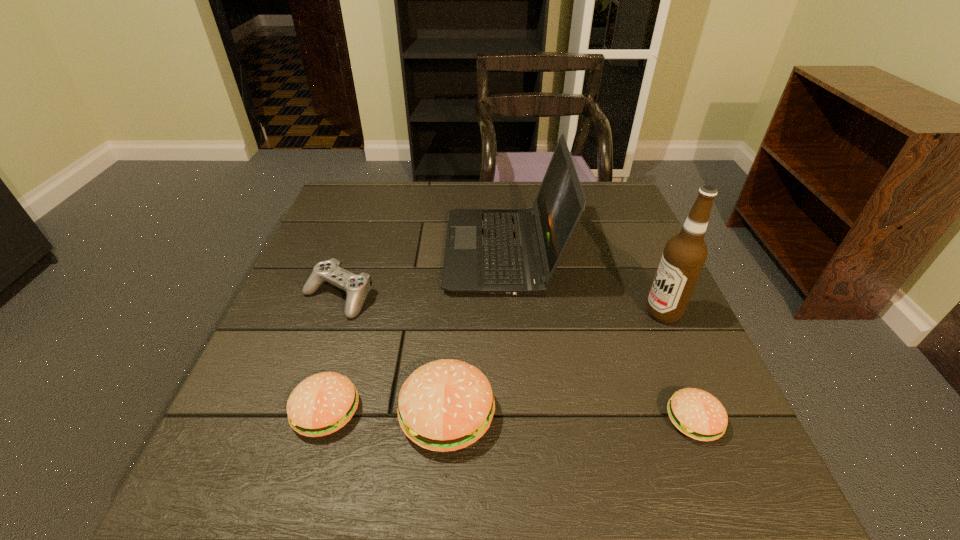
Find the location of a particular element. This screenshot has width=960, height=540. control situated at the left edge is located at coordinates (356, 287).

Identify the location of patty that is at the right edge. (696, 413).

You are a GUI agent. You are given a task and a screenshot of the screen. Output one action in this format:
    pyautogui.click(x=<x>, y=<y>)
    Task: Click on the alcohol located in the right edge section of the desktop
    The height and width of the screenshot is (540, 960).
    Given the screenshot: What is the action you would take?
    [685, 254]

Where is `object situated at the near left corner`? Image resolution: width=960 pixels, height=540 pixels. object situated at the near left corner is located at coordinates (323, 403).

Find the location of `object situated at the near right corner`. object situated at the near right corner is located at coordinates (696, 413).

At what (x,y) coordinates should I click in order to perform the action: click on vacant area at the far edge of the desktop. Please return your answer as a coordinate pair (x, y). This screenshot has height=540, width=960. Looking at the image, I should click on (392, 197).

Find the location of a particular element. vacant space at the near edge is located at coordinates tap(588, 426).

The image size is (960, 540). In order to click on free location at the left edge in this screenshot , I will do `click(338, 249)`.

I want to click on vacant space at the right edge of the desktop, so (718, 388).

Locate an element on the screen. vacant space at the far left corner of the desktop is located at coordinates (343, 205).